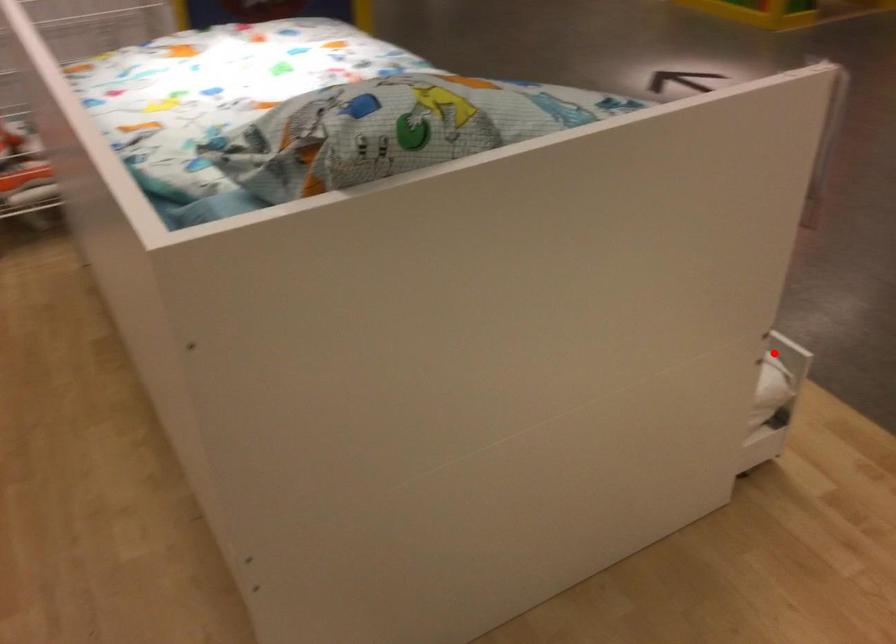
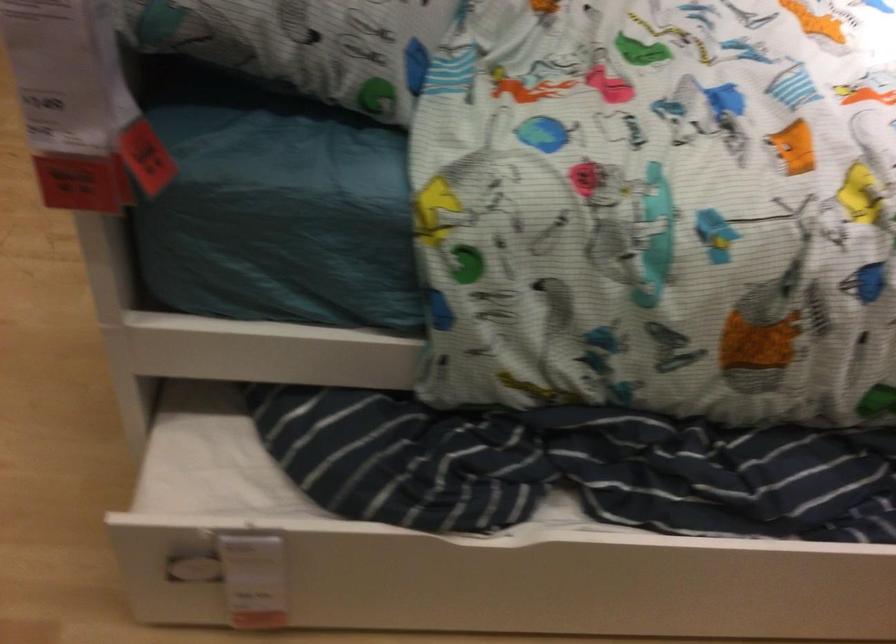
Question: I am providing you with two images of the same scene from different viewpoints. In image1, a red point is highlighted. Considering the same 3D point in image2, which of the following is correct?

Choices:
 (A) It is closer
 (B) It is farther

Answer: (A)